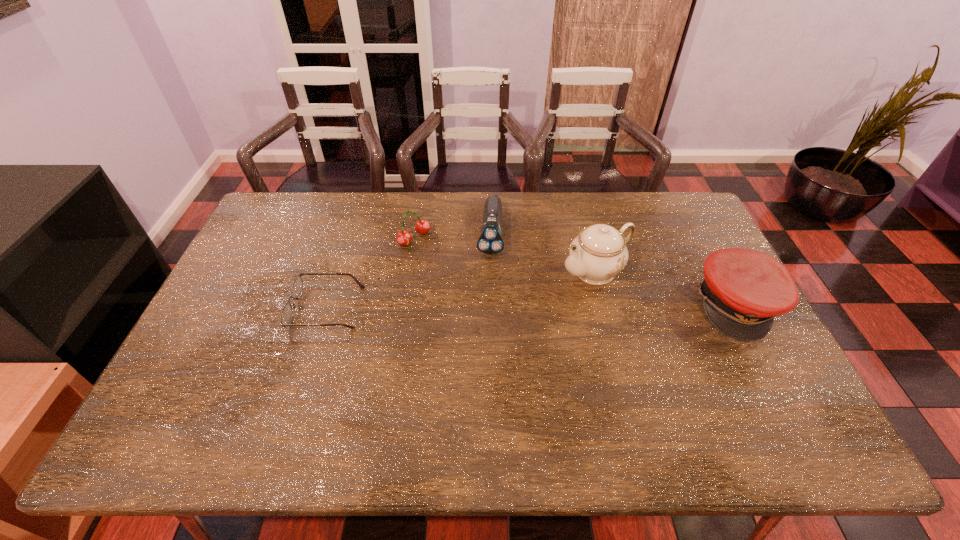
Locate an element on the screen. vacant space located 0.370m at the spout of the chinaware is located at coordinates (464, 334).

Find the location of a particular element. This screenshot has height=540, width=960. cherry located in the far edge section of the desktop is located at coordinates (422, 226).

Identify the location of electric shaver that is at the far edge. (490, 242).

Where is `object located at the right edge`? The image size is (960, 540). object located at the right edge is located at coordinates (743, 290).

The width and height of the screenshot is (960, 540). In the image, there is a desktop. In order to click on free space at the far edge in this screenshot , I will do `click(606, 202)`.

Identify the location of vacant space at the near edge. The width and height of the screenshot is (960, 540). (322, 380).

The height and width of the screenshot is (540, 960). I want to click on blank area at the far left corner, so click(296, 233).

Locate an element on the screen. Image resolution: width=960 pixels, height=540 pixels. free space between the tallest object and the electric shaver is located at coordinates (542, 252).

What are the coordinates of `empty location between the third object from left to right and the cherry` in the screenshot? It's located at (452, 235).

Identify the location of free space between the cap and the shortest object. (532, 306).